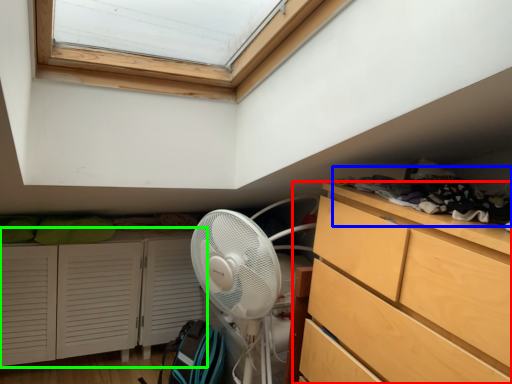
Question: Which object is positioned closest to chest of drawers (highlighted by a red box)? Select from laundry (highlighted by a blue box) and cupboard (highlighted by a green box).

Choices:
 (A) laundry
 (B) cupboard

Answer: (A)